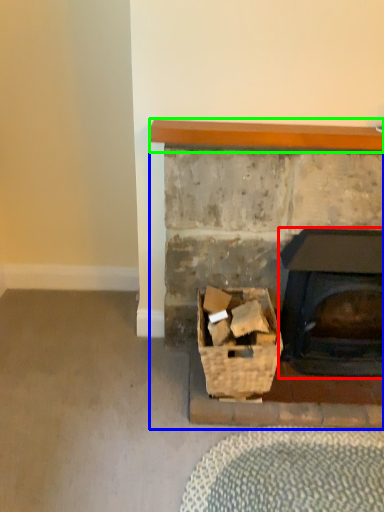
Question: Estimate the real-world distances between objects in this image. Which object is farther from wood burning stove (highlighted by a red box), fireplace (highlighted by a blue box) or balustrade (highlighted by a green box)?

Choices:
 (A) fireplace
 (B) balustrade

Answer: (B)